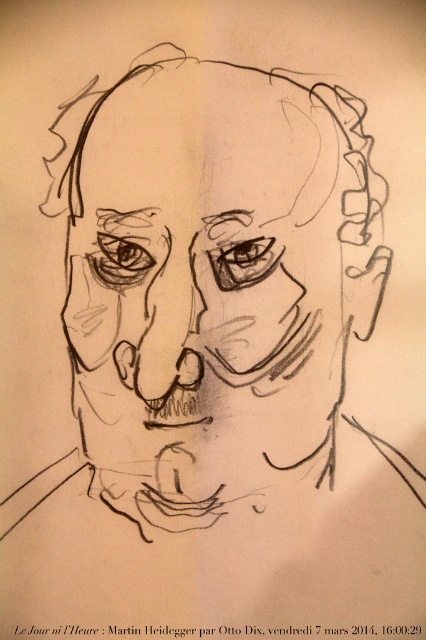
Question: Observing the image, what is the correct spatial positioning of graphite sketch of head at center in reference to matte black nose at center?

Choices:
 (A) right
 (B) left

Answer: (A)

Question: Which point is closer to the camera taking this photo?

Choices:
 (A) (138, 362)
 (B) (313, 419)

Answer: (B)

Question: Which object is farther from the camera taking this photo?

Choices:
 (A) graphite sketch of head at center
 (B) matte black nose at center

Answer: (B)

Question: Is the position of graphite sketch of head at center less distant than that of matte black nose at center?

Choices:
 (A) no
 (B) yes

Answer: (B)

Question: Is graphite sketch of head at center positioned in front of matte black nose at center?

Choices:
 (A) yes
 (B) no

Answer: (A)